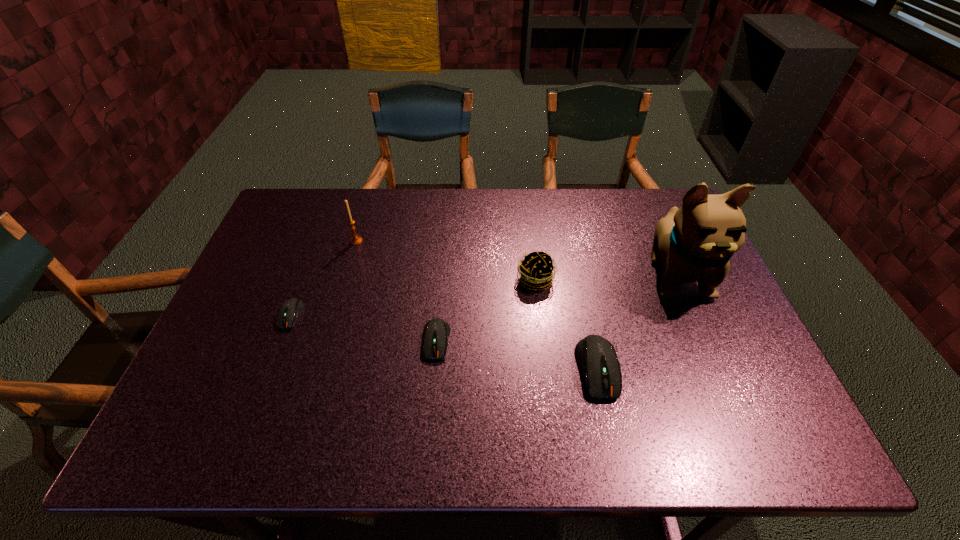
In the current image, all computer equipments are evenly spaced. To maintain this equal spacing, where should an additional computer equipment be placed on the right? Please point out a free spot. Please provide its 2D coordinates. Your answer should be formatted as a tuple, i.e. [(x, y)], where the tuple contains the x and y coordinates of a point satisfying the conditions above.

[(777, 400)]